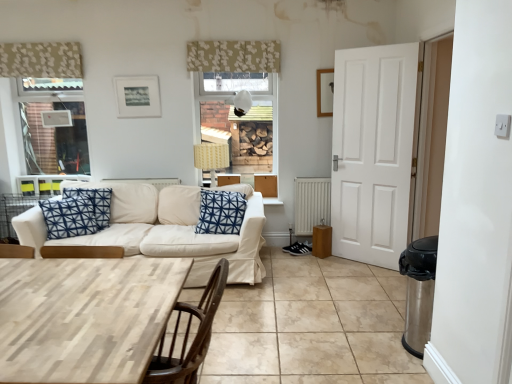
Question: Considering the relative sizes of light wood table at lower left and matte black picture frame at upper center, which ranks as the 1th picture frame in left-to-right order, in the image provided, is light wood table at lower left taller than matte black picture frame at upper center, which ranks as the 1th picture frame in left-to-right order,?

Choices:
 (A) yes
 (B) no

Answer: (A)

Question: Is light wood table at lower left positioned with its back to matte black picture frame at upper center, positioned as the 2th picture frame in right-to-left order?

Choices:
 (A) no
 (B) yes

Answer: (A)

Question: Could you tell me if light wood table at lower left is turned towards matte black picture frame at upper center, which ranks as the 1th picture frame in left-to-right order?

Choices:
 (A) no
 (B) yes

Answer: (A)

Question: Is light wood table at lower left thinner than matte black picture frame at upper center, which ranks as the 1th picture frame in left-to-right order?

Choices:
 (A) yes
 (B) no

Answer: (B)

Question: Is light wood table at lower left smaller than matte black picture frame at upper center, which ranks as the 1th picture frame in left-to-right order?

Choices:
 (A) no
 (B) yes

Answer: (A)

Question: From a real-world perspective, is floral fabric curtain at upper center, which ranks as the 2th curtain in left-to-right order, positioned above or below matte black picture frame at upper center, positioned as the 2th picture frame in right-to-left order?

Choices:
 (A) above
 (B) below

Answer: (A)

Question: Based on their positions, is floral fabric curtain at upper center, which is the first curtain in right-to-left order, located to the left or right of matte black picture frame at upper center, which ranks as the 1th picture frame in left-to-right order?

Choices:
 (A) right
 (B) left

Answer: (A)

Question: Which is correct: floral fabric curtain at upper center, which ranks as the 2th curtain in left-to-right order, is inside matte black picture frame at upper center, which ranks as the 1th picture frame in left-to-right order, or outside of it?

Choices:
 (A) outside
 (B) inside

Answer: (A)

Question: Does point (219, 69) appear closer or farther from the camera than point (122, 99)?

Choices:
 (A) closer
 (B) farther

Answer: (A)

Question: Is point (36, 64) positioned closer to the camera than point (294, 188)?

Choices:
 (A) closer
 (B) farther

Answer: (A)

Question: Is patterned fabric curtain at upper left, the first curtain viewed from the left, in front of or behind white metallic radiator at lower center in the image?

Choices:
 (A) behind
 (B) front

Answer: (B)

Question: From a real-world perspective, is patterned fabric curtain at upper left, the first curtain viewed from the left, above or below white metallic radiator at lower center?

Choices:
 (A) above
 (B) below

Answer: (A)

Question: Based on their sizes in the image, would you say patterned fabric curtain at upper left, the first curtain viewed from the left, is bigger or smaller than white metallic radiator at lower center?

Choices:
 (A) big
 (B) small

Answer: (B)

Question: Looking at the image, does wooden picture frame at upper right, positioned as the 1th picture frame in right-to-left order, seem bigger or smaller compared to blue printed cushion at center?

Choices:
 (A) small
 (B) big

Answer: (A)

Question: Does point (326, 91) appear closer or farther from the camera than point (238, 193)?

Choices:
 (A) closer
 (B) farther

Answer: (B)